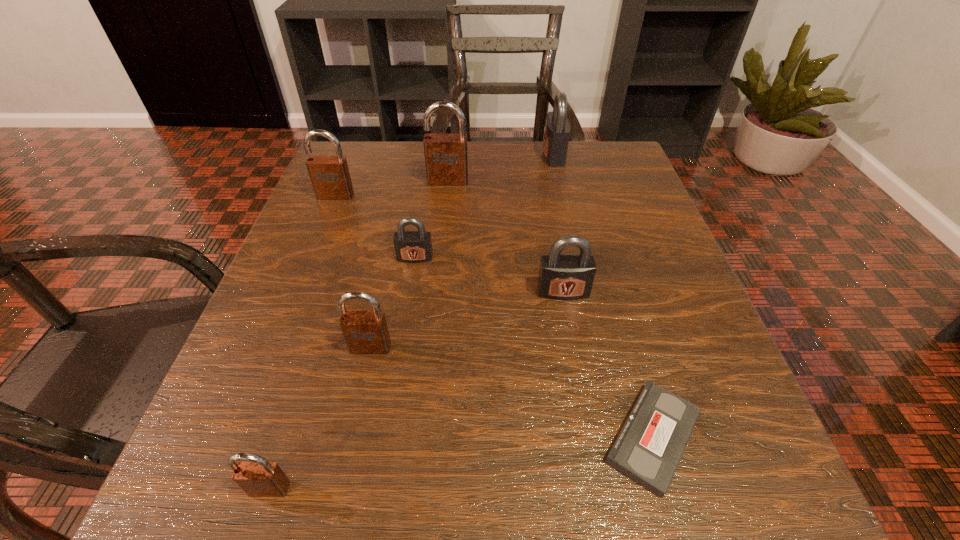
You are a GUI agent. You are given a task and a screenshot of the screen. Output one action in this format:
    pyautogui.click(x=<x>, y=<y>)
    Task: Click on the unoccupied position between the smallest gray padlock and the farthest gray padlock
    Image resolution: width=960 pixels, height=540 pixels.
    Given the screenshot: What is the action you would take?
    pyautogui.click(x=485, y=206)

Find the location of a particular element. This screenshot has width=960, height=540. free space between the shortest object and the leftmost gray padlock is located at coordinates (534, 347).

The height and width of the screenshot is (540, 960). I want to click on vacant region between the smallest gray padlock and the videotape, so click(534, 347).

Where is `blank region between the second nearest gray padlock and the farthest gray padlock`? blank region between the second nearest gray padlock and the farthest gray padlock is located at coordinates (485, 206).

Find the location of a particular element. This screenshot has width=960, height=540. vacant space that is in between the farthest padlock and the nearest brown padlock is located at coordinates (412, 322).

This screenshot has height=540, width=960. In order to click on unoccupied position between the leftmost padlock and the second smallest gray padlock in this screenshot , I will do 449,244.

Identify the location of free spot between the third nearest object and the rightmost brown padlock. The width and height of the screenshot is (960, 540). (409, 264).

Image resolution: width=960 pixels, height=540 pixels. I want to click on object identified as the second closest to the farthest gray padlock, so click(564, 277).

Identify which object is the fourth closest to the second biggest gray padlock. Please provide its 2D coordinates. Your answer should be formatted as a tuple, i.e. [(x, y)], where the tuple contains the x and y coordinates of a point satisfying the conditions above.

[(446, 159)]

Identify the location of padlock object that ranks as the second closest to the farthest padlock. (564, 277).